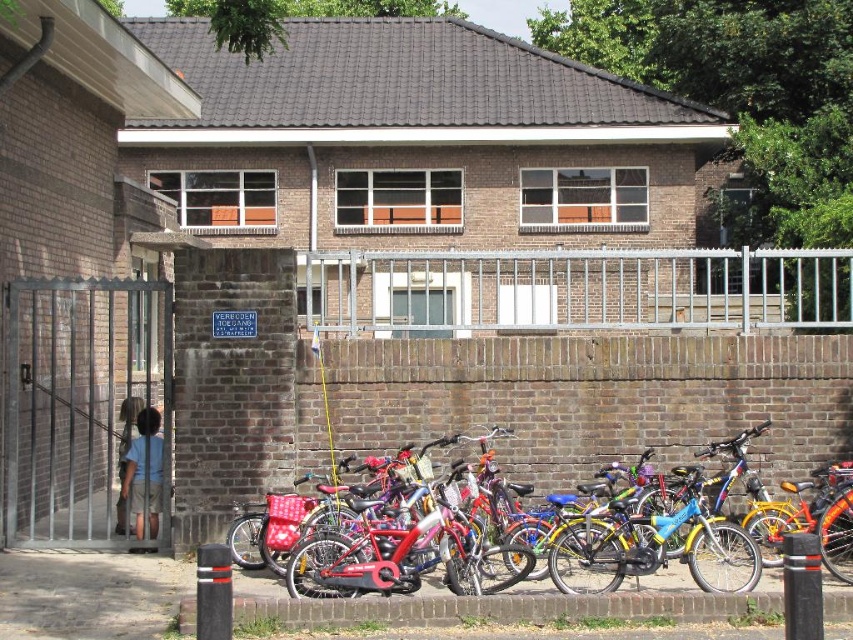
You are standing in front of the brick building and want to walk from the sidewalk to the parking area. There are two points marked on the ground. Which point is closer to you, point [749,326] or point [639,468]?

Point [749,326] is closer to you because it is further to the viewer than point [639,468].

Based on the photo, you are standing on the sidewalk in front of the building and want to enter through the gate. Which object, the metallic gate at left or the shiny red bicycle at center, is closer to you as you face the building?

The metallic gate at left is closer to you because it is further to the viewer than the shiny red bicycle at center, meaning it appears nearer in the scene.

You are a delivery person with a large package. You need to pass through either the silver metallic fence at center or the metallic gate at left to reach the building. Based on their widths, which one would allow you to carry your package through more easily?

The silver metallic fence at center might be wider than the metallic gate at left, so it would allow easier passage for your large package.